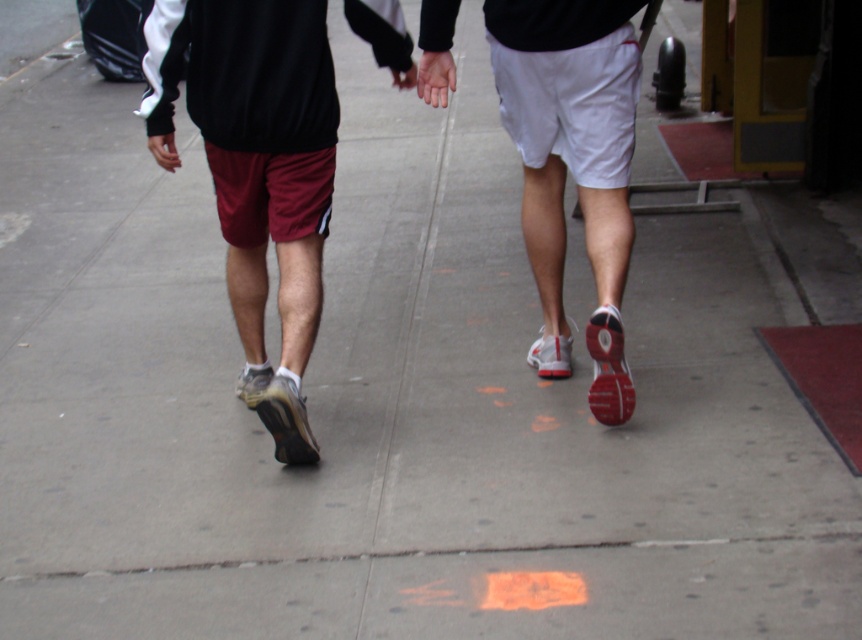
Question: Estimate the real-world distances between objects in this image. Which object is closer to the smooth skin hand at center?

Choices:
 (A) matte black shorts at center
 (B) white matte shorts at center

Answer: (B)

Question: Is matte black shorts at center below white matte shorts at center?

Choices:
 (A) no
 (B) yes

Answer: (A)

Question: Estimate the real-world distances between objects in this image. Which object is closer to the smooth skin hand at center?

Choices:
 (A) matte black shorts at center
 (B) white matte shorts at center

Answer: (B)

Question: Which of the following is the farthest from the observer?

Choices:
 (A) (422, 77)
 (B) (578, 32)

Answer: (A)

Question: Can you confirm if white matte shorts at center is positioned to the right of smooth skin hand at center?

Choices:
 (A) no
 (B) yes

Answer: (B)

Question: Is matte black shorts at center thinner than smooth skin hand at center?

Choices:
 (A) yes
 (B) no

Answer: (B)